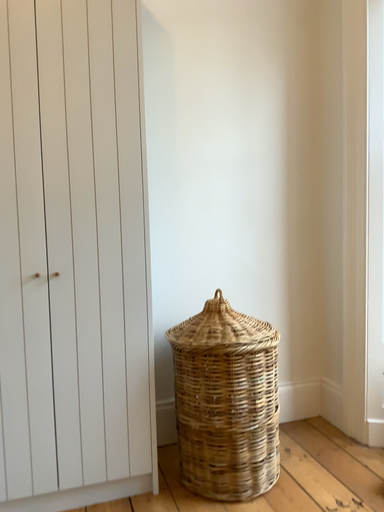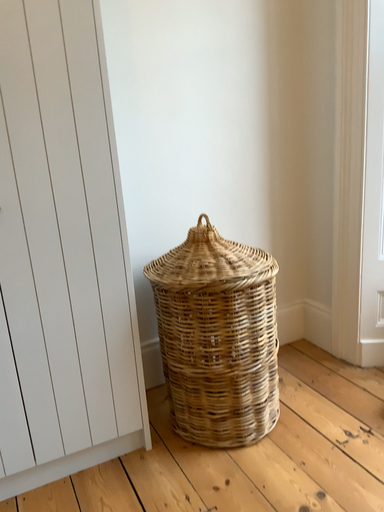
Question: Which way did the camera rotate in the video?

Choices:
 (A) rotated left
 (B) rotated right

Answer: (B)